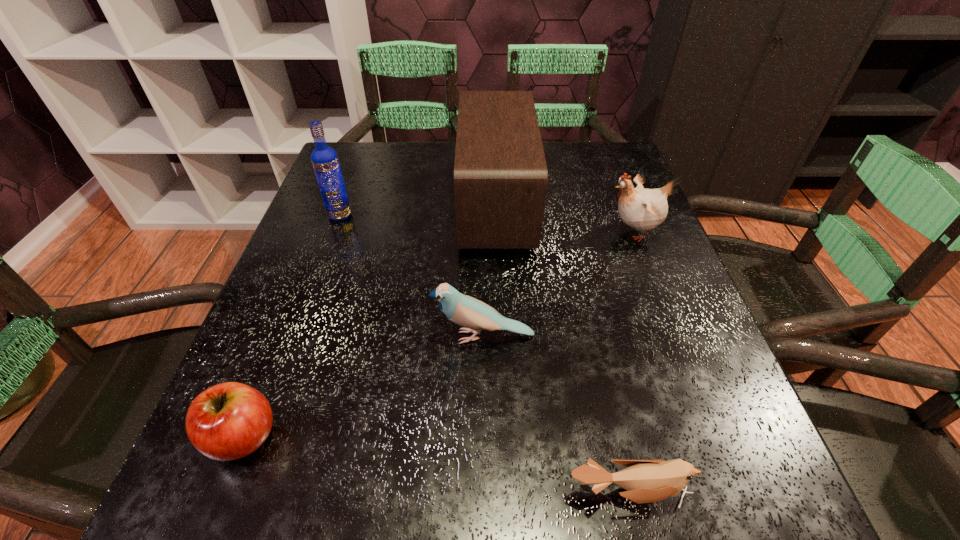
At what (x,y) coordinates should I click in order to perform the action: click on vacant area that lies between the nearest object and the farthest bird. Please return your answer as a coordinate pair (x, y). Looking at the image, I should click on (631, 363).

At what (x,y) coordinates should I click in order to perform the action: click on object that is the fourth closest to the farthest bird. Please return your answer as a coordinate pair (x, y). The image size is (960, 540). Looking at the image, I should click on (325, 161).

Select which object is the third closest to the leftmost bird. Please provide its 2D coordinates. Your answer should be formatted as a tuple, i.e. [(x, y)], where the tuple contains the x and y coordinates of a point satisfying the conditions above.

[(228, 421)]

Select which bird is the closest to the farthest bird. Please provide its 2D coordinates. Your answer should be formatted as a tuple, i.e. [(x, y)], where the tuple contains the x and y coordinates of a point satisfying the conditions above.

[(466, 311)]

Find the location of a particular element. The image size is (960, 540). bird that can be found as the closest to the farthest bird is located at coordinates (466, 311).

Find the location of a particular element. This screenshot has width=960, height=540. free space that satisfies the following two spatial constraints: 1. at the face of the second farthest bird; 2. on the front side of the apple is located at coordinates (481, 436).